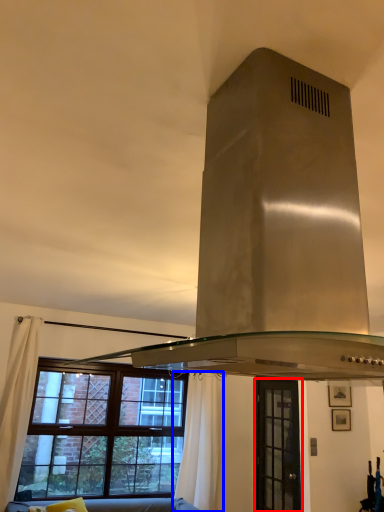
Question: Which object is closer to the camera taking this photo, window (highlighted by a red box) or curtain (highlighted by a blue box)?

Choices:
 (A) window
 (B) curtain

Answer: (A)